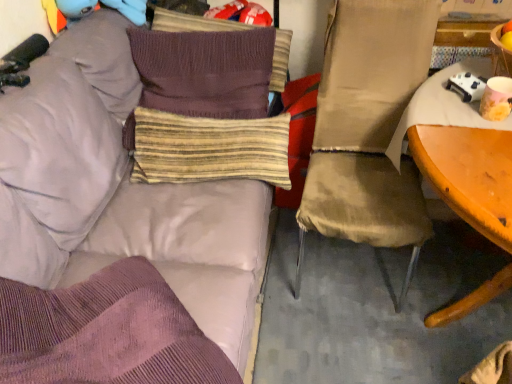
Question: Is striped fabric pillow at center, the first pillow when ordered from bottom to top, in front of or behind matte beige chair at right in the image?

Choices:
 (A) behind
 (B) front

Answer: (A)

Question: Looking at their shapes, would you say striped fabric pillow at center, the first pillow when ordered from bottom to top, is wider or thinner than matte beige chair at right?

Choices:
 (A) thin
 (B) wide

Answer: (A)

Question: Which is nearer to the matte purple couch at upper left?

Choices:
 (A) knitted brown pillow at center, which ranks as the 3th pillow in bottom-to-top order
 (B) matte yellow cup at right
 (C) knitted brown pillow at upper center, placed as the 4th pillow when sorted from bottom to top
 (D) striped fabric pillow at center, the third pillow from the top
 (E) matte beige chair at right

Answer: (A)

Question: Which object is the farthest from the matte yellow cup at right?

Choices:
 (A) knitted brown pillow at center, which ranks as the 3th pillow in bottom-to-top order
 (B) striped fabric pillow at center, the second pillow when ordered from bottom to top
 (C) matte purple couch at upper left
 (D) striped fabric pillow at center, the fourth pillow when ordered from top to bottom
 (E) knitted brown pillow at upper center, placed as the 4th pillow when sorted from bottom to top

Answer: (C)